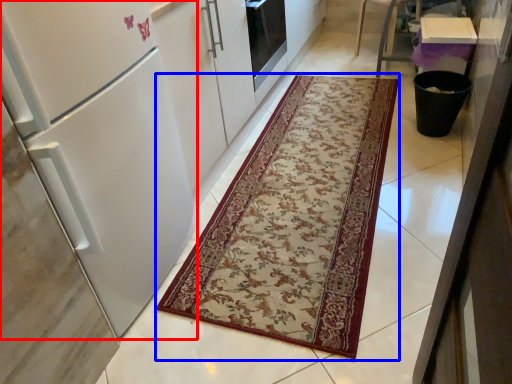
Question: Which object appears farthest to the camera in this image, refrigerator (highlighted by a red box) or mat (highlighted by a blue box)?

Choices:
 (A) refrigerator
 (B) mat

Answer: (B)